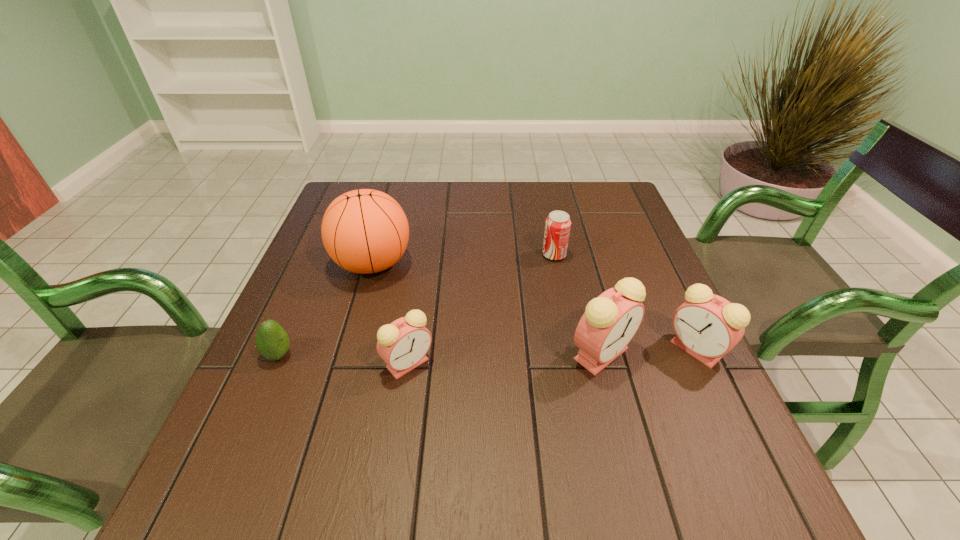
You are a GUI agent. You are given a task and a screenshot of the screen. Output one action in this format:
    pyautogui.click(x=<x>, y=<y>)
    Task: Click on the leftmost alarm clock
    This screenshot has height=540, width=960.
    Given the screenshot: What is the action you would take?
    pyautogui.click(x=403, y=344)

What are the coordinates of `the second alarm clock from left to right` in the screenshot? It's located at (610, 321).

The image size is (960, 540). I want to click on the rightmost object, so click(x=707, y=326).

What are the coordinates of `the second shortest alarm clock` in the screenshot? It's located at (707, 326).

Identify the location of basketball. The height and width of the screenshot is (540, 960). (364, 231).

Locate an element on the screen. The width and height of the screenshot is (960, 540). soda can is located at coordinates tap(558, 224).

You are a GUI agent. You are given a task and a screenshot of the screen. Output one action in this format:
    pyautogui.click(x=<x>, y=<y>)
    Task: Click on the leftmost object
    
    Given the screenshot: What is the action you would take?
    (x=272, y=342)

Find the location of a particular element. This screenshot has width=960, height=540. the shortest object is located at coordinates (272, 342).

What are the coordinates of `vacant space situated on the face of the leftmost alarm clock` in the screenshot? It's located at (396, 441).

In order to click on free space located on the face of the second alarm clock from right to left in this screenshot , I will do `click(621, 428)`.